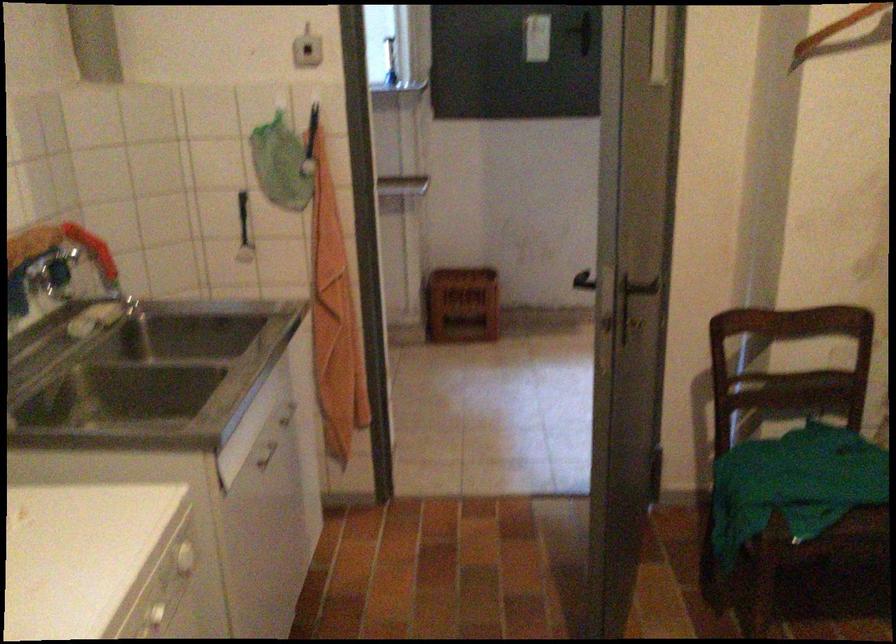
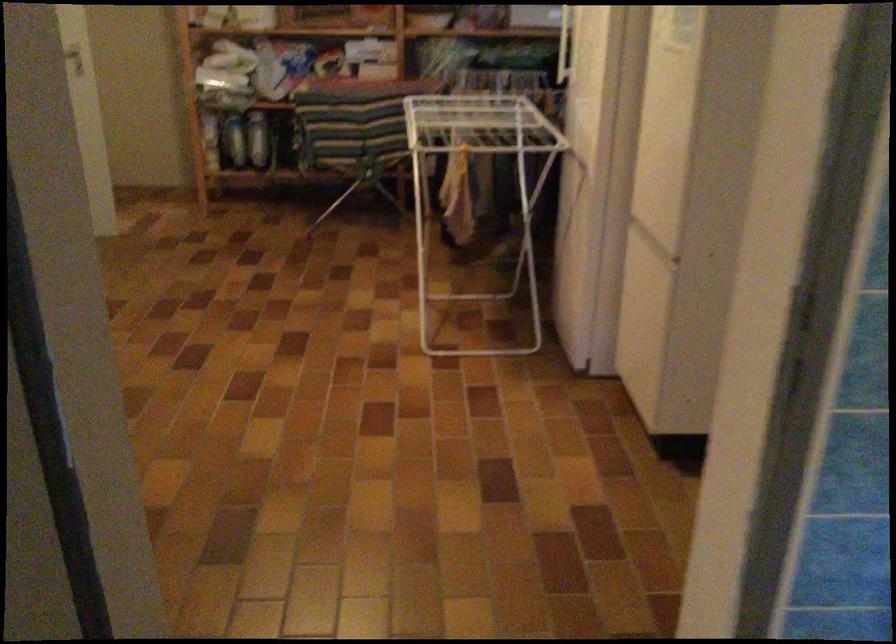
First-person continuous shooting, in which direction is the camera rotating?

The camera rotated toward right-down.